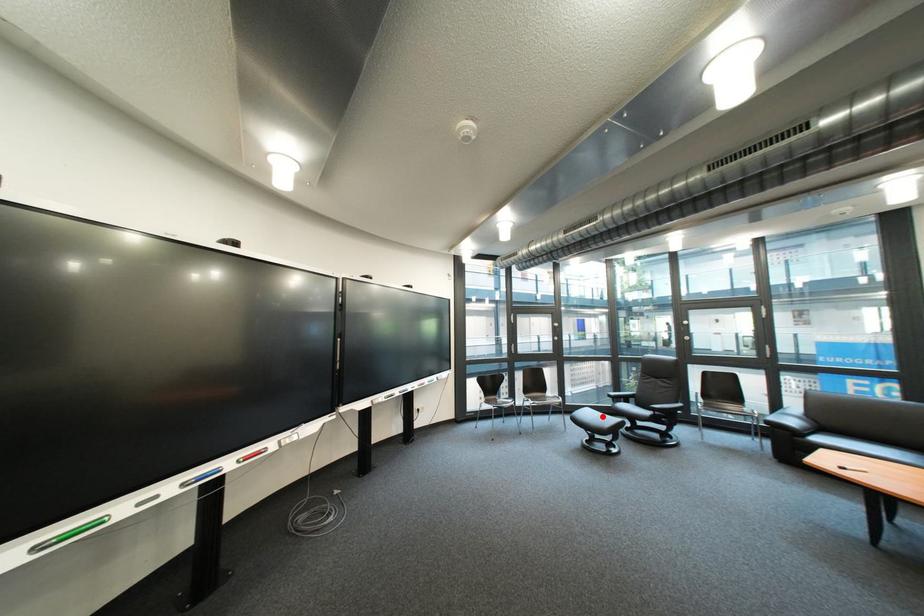
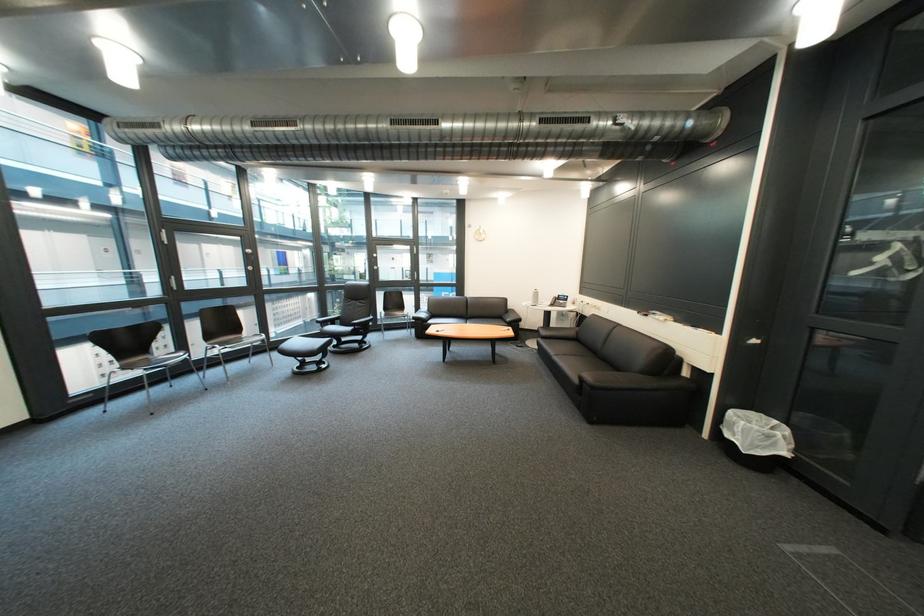
Locate, in the second image, the point that corresponds to the highlighted location in the first image.

(311, 345)